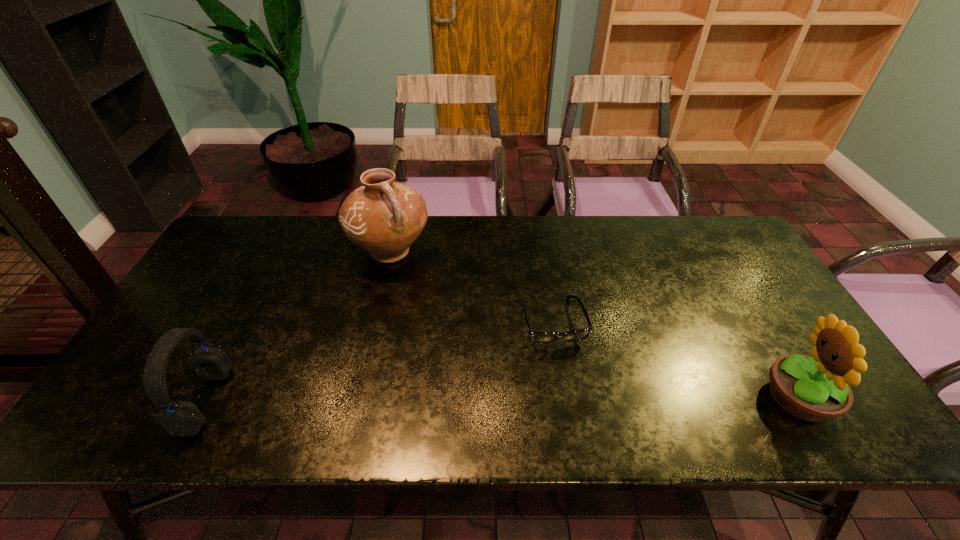
Image resolution: width=960 pixels, height=540 pixels. Identify the location of headset. (179, 418).

This screenshot has height=540, width=960. I want to click on the leftmost object, so click(x=179, y=418).

Image resolution: width=960 pixels, height=540 pixels. Find the location of `sunflower`. sunflower is located at coordinates (816, 388).

Image resolution: width=960 pixels, height=540 pixels. I want to click on the farthest object, so click(x=383, y=217).

This screenshot has height=540, width=960. What are the coordinates of `pottery` in the screenshot? It's located at (383, 217).

At what (x,y) coordinates should I click in order to perform the action: click on the second farthest object. Please return your answer as a coordinate pair (x, y). This screenshot has width=960, height=540. Looking at the image, I should click on (577, 335).

At what (x,y) coordinates should I click in order to perform the action: click on the third object from left to right. Please return your answer as a coordinate pair (x, y). This screenshot has height=540, width=960. Looking at the image, I should click on (577, 335).

Find the location of a particular element. The image size is (960, 540). vacant space located 0.130m on the headband of the leftmost object is located at coordinates pos(280,401).

This screenshot has height=540, width=960. I want to click on vacant space located 0.370m on the face of the sunflower, so click(x=603, y=397).

Where is `free space located on the face of the sunflower`? The image size is (960, 540). free space located on the face of the sunflower is located at coordinates (656, 397).